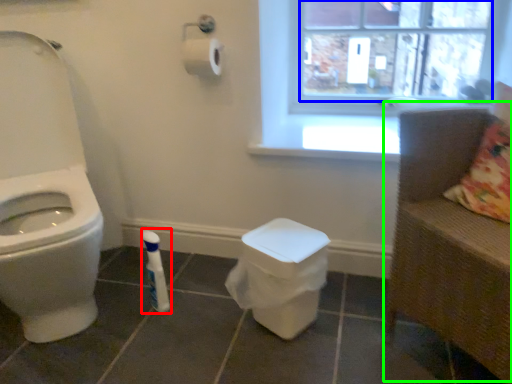
Question: Which object is the farthest from toiletry (highlighted by a red box)? Choose among these: window screen (highlighted by a blue box) or armchair (highlighted by a green box).

Choices:
 (A) window screen
 (B) armchair

Answer: (A)